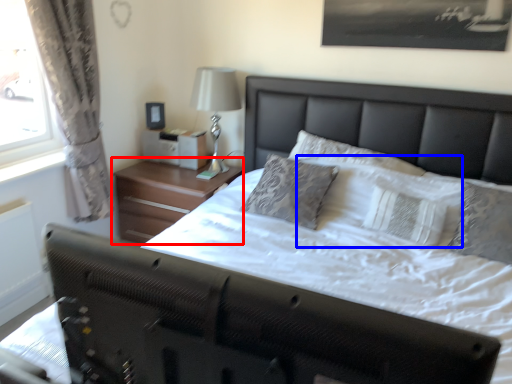
Question: Which point is further to the camera, nightstand (highlighted by a red box) or pillow (highlighted by a blue box)?

Choices:
 (A) nightstand
 (B) pillow

Answer: (A)